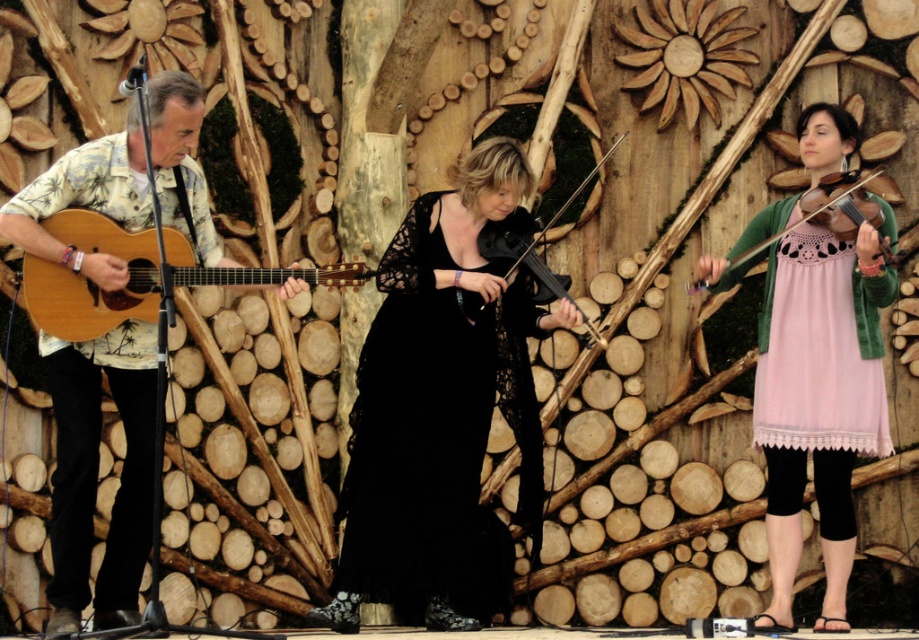
Question: Which is farther from the wooden acoustic guitar at left?

Choices:
 (A) black matte violin at center
 (B) matte wood guitar at left

Answer: (A)

Question: Which of these objects is positioned closest to the pink lace dress at center?

Choices:
 (A) wooden acoustic guitar at left
 (B) matte wood guitar at left
 (C) matte black violin at right
 (D) black matte violin at center

Answer: (C)

Question: Which object is the farthest from the black matte violin at center?

Choices:
 (A) pink lace dress at center
 (B) matte wood guitar at left

Answer: (B)

Question: Observing the image, what is the correct spatial positioning of black lace dress at center in reference to pink lace dress at right?

Choices:
 (A) right
 (B) left

Answer: (B)

Question: Is the position of matte wood guitar at left less distant than that of black matte violin at center?

Choices:
 (A) yes
 (B) no

Answer: (A)

Question: Can you confirm if pink lace dress at center is smaller than pink lace dress at right?

Choices:
 (A) yes
 (B) no

Answer: (B)